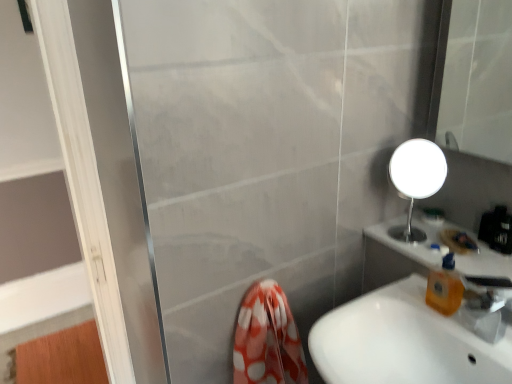
Question: From the image's perspective, is transparent plastic tap at lower right located above or below white glossy sink at lower right?

Choices:
 (A) above
 (B) below

Answer: (A)

Question: In terms of width, does transparent plastic tap at lower right look wider or thinner when compared to white glossy sink at lower right?

Choices:
 (A) wide
 (B) thin

Answer: (B)

Question: Which object is positioned farthest from the transparent plastic tap at lower right?

Choices:
 (A) orange translucent soap dispenser at right
 (B) white glossy sink at lower right

Answer: (B)

Question: Which object is the farthest from the transparent plastic tap at lower right?

Choices:
 (A) orange translucent soap dispenser at right
 (B) white glossy sink at lower right

Answer: (B)